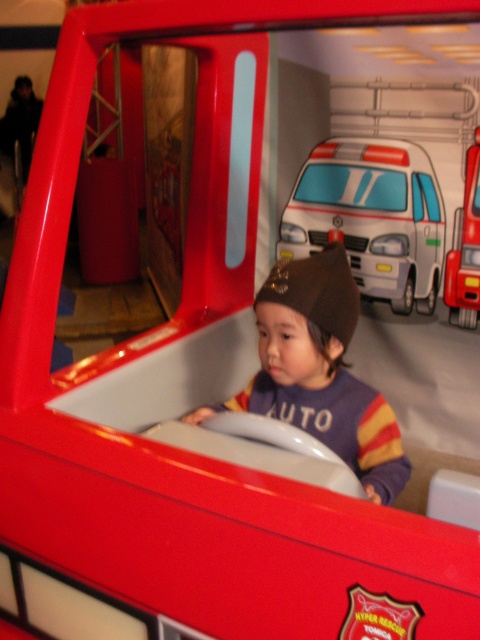
Which is below, purple soft hat at center or metallic red fire truck at center?

purple soft hat at center is below.

Which of these two, purple soft hat at center or metallic red fire truck at center, stands taller?

With more height is metallic red fire truck at center.

Is point (252, 385) positioned behind point (476, 220)?

That is False.

Where is `purple soft hat at center`? The height and width of the screenshot is (640, 480). purple soft hat at center is located at coordinates (322, 369).

Between point (384, 232) and point (458, 317), which one is positioned behind?

Point (384, 232)

Which is in front, point (300, 228) or point (465, 198)?

Point (465, 198)

Where is `white glossy ambulance at upper center`? white glossy ambulance at upper center is located at coordinates (372, 218).

From the picture: Who is positioned more to the left, purple soft hat at center or white glossy ambulance at upper center?

From the viewer's perspective, purple soft hat at center appears more on the left side.

Is point (247, 388) positioned after point (355, 225)?

That is False.

In order to click on purple soft hat at center in this screenshot , I will do click(322, 369).